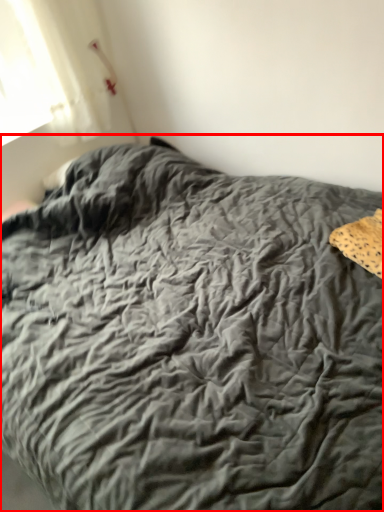
Question: Considering the relative positions of bed (annotated by the red box) and material in the image provided, where is bed (annotated by the red box) located with respect to the staircase?

Choices:
 (A) right
 (B) left

Answer: (B)